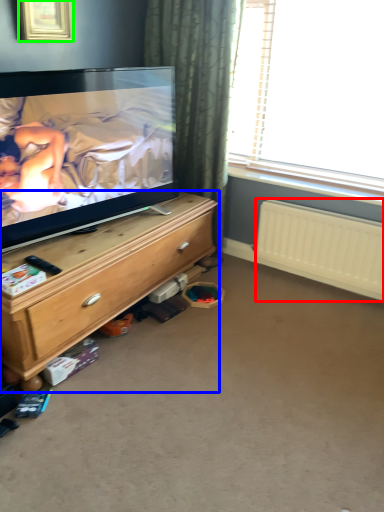
Question: Considering the real-world distances, which object is farthest from radiator (highlighted by a red box)? chest of drawers (highlighted by a blue box) or picture frame (highlighted by a green box)?

Choices:
 (A) chest of drawers
 (B) picture frame

Answer: (B)